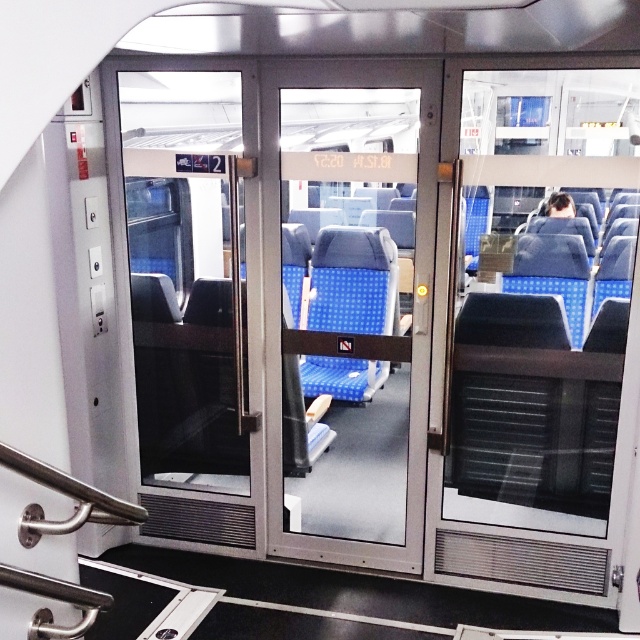
You are a maintenance worker who needs to check the camera located near the transparent glass door at right. You have a 2.5 meter ladder. Can you safely reach the camera with the ladder?

The distance between the transparent glass door at right and the camera is 2.76 meters. Since the ladder is only 2.5 meters long, it is not long enough to safely reach the camera.